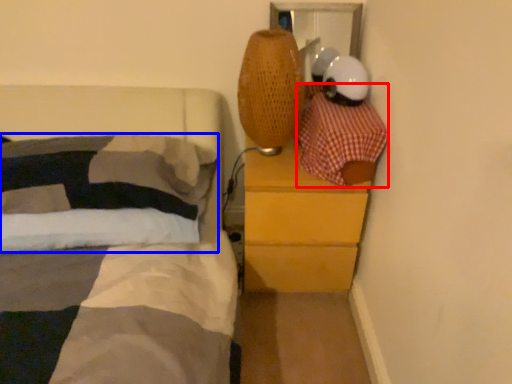
Question: Which object is closer to the camera taking this photo, blanket (highlighted by a red box) or pillow (highlighted by a blue box)?

Choices:
 (A) blanket
 (B) pillow

Answer: (A)